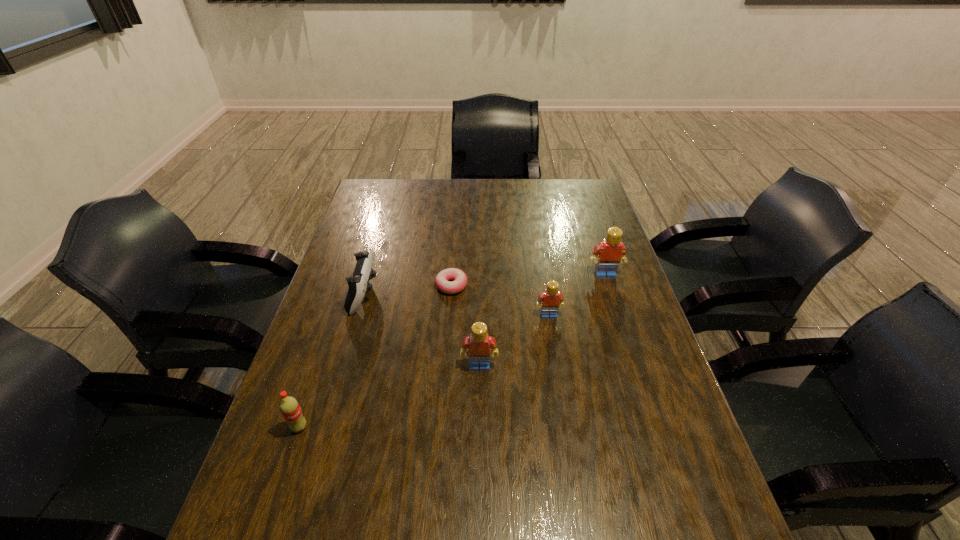
Find the location of `free spot that satisfies the following two spatial constraints: 1. on the front-facing side of the farthest Lego; 2. on the front-facing side of the second object from left to right`. free spot that satisfies the following two spatial constraints: 1. on the front-facing side of the farthest Lego; 2. on the front-facing side of the second object from left to right is located at coordinates (612, 295).